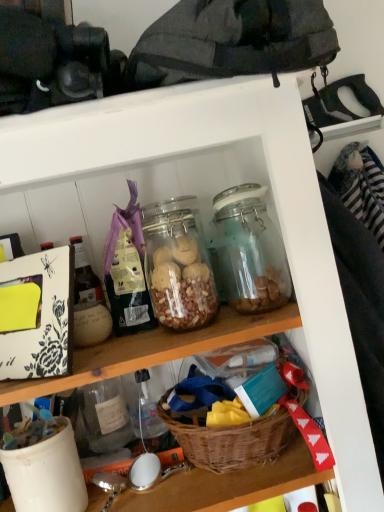
In order to face woven brown basket at lower center, should I rotate leftwards or rightwards?

You should look right and rotate roughly 5.720 degrees.

Find the location of a particular element. The width and height of the screenshot is (384, 512). woven brown basket at lower center is located at coordinates (232, 441).

Describe the element at coordinates (232, 441) in the screenshot. The height and width of the screenshot is (512, 384). I see `woven brown basket at lower center` at that location.

Locate an element on the screen. translucent glass jar at center is located at coordinates (180, 283).

What do you see at coordinates (180, 283) in the screenshot? The height and width of the screenshot is (512, 384). I see `translucent glass jar at center` at bounding box center [180, 283].

The image size is (384, 512). What are the coordinates of `woven brown basket at lower center` in the screenshot? It's located at (232, 441).

Which is more to the right, woven brown basket at lower center or translucent glass jar at center?

From the viewer's perspective, woven brown basket at lower center appears more on the right side.

From the picture: Who is more distant, woven brown basket at lower center or translucent glass jar at center?

Positioned behind is translucent glass jar at center.

Is point (193, 449) behind point (183, 260)?

That is True.

From the image's perspective, would you say woven brown basket at lower center is shown under translucent glass jar at center?

Yes, from the image's perspective, woven brown basket at lower center is beneath translucent glass jar at center.

From a real-world perspective, does woven brown basket at lower center sit lower than translucent glass jar at center?

Yes.

Can you confirm if woven brown basket at lower center is thinner than translucent glass jar at center?

No, woven brown basket at lower center is not thinner than translucent glass jar at center.

Which of these two, woven brown basket at lower center or translucent glass jar at center, stands taller?

With more height is translucent glass jar at center.

Which of these two, woven brown basket at lower center or translucent glass jar at center, is smaller?

translucent glass jar at center is smaller.

Can we say woven brown basket at lower center lies outside translucent glass jar at center?

Absolutely, woven brown basket at lower center is external to translucent glass jar at center.

Is woven brown basket at lower center next to translucent glass jar at center and touching it?

woven brown basket at lower center is not next to translucent glass jar at center, and they're not touching.

Is woven brown basket at lower center facing towards translucent glass jar at center?

No.

Can you tell me how much woven brown basket at lower center and translucent glass jar at center differ in facing direction?

The angle between the facing direction of woven brown basket at lower center and the facing direction of translucent glass jar at center is 3.82 degrees.

How distant is woven brown basket at lower center from translucent glass jar at center?

They are 9.19 inches apart.

The height and width of the screenshot is (512, 384). I want to click on food on the left of the woven brown basket at lower center, so coord(180,283).

Considering the positions of objects translucent glass jar at center and woven brown basket at lower center in the image provided, who is more to the right, translucent glass jar at center or woven brown basket at lower center?

woven brown basket at lower center.

Does translucent glass jar at center lie behind woven brown basket at lower center?

That is True.

Does point (200, 321) lie behind point (177, 439)?

No.

From the image's perspective, is translucent glass jar at center above or below woven brown basket at lower center?

translucent glass jar at center is situated higher than woven brown basket at lower center in the image.

From a real-world perspective, who is located lower, translucent glass jar at center or woven brown basket at lower center?

woven brown basket at lower center, from a real-world perspective.

Does translucent glass jar at center have a lesser width compared to woven brown basket at lower center?

Yes, translucent glass jar at center is thinner than woven brown basket at lower center.

Considering the relative sizes of translucent glass jar at center and woven brown basket at lower center in the image provided, is translucent glass jar at center taller than woven brown basket at lower center?

Correct, translucent glass jar at center is much taller as woven brown basket at lower center.

From the picture: Between translucent glass jar at center and woven brown basket at lower center, which one has smaller size?

With smaller size is translucent glass jar at center.

Is woven brown basket at lower center located within translucent glass jar at center?

Actually, woven brown basket at lower center is outside translucent glass jar at center.

Is the surface of translucent glass jar at center in direct contact with woven brown basket at lower center?

No.

Could you tell me if translucent glass jar at center is facing woven brown basket at lower center?

No, translucent glass jar at center is not oriented towards woven brown basket at lower center.

Can you tell me how much translucent glass jar at center and woven brown basket at lower center differ in facing direction?

There is a 3.82-degree angle between the facing directions of translucent glass jar at center and woven brown basket at lower center.

How far apart are translucent glass jar at center and woven brown basket at lower center?

translucent glass jar at center is 9.19 inches from woven brown basket at lower center.

Identify the location of basket that appears on the right of translucent glass jar at center. Image resolution: width=384 pixels, height=512 pixels. (232, 441).

Image resolution: width=384 pixels, height=512 pixels. In order to click on basket beneath the translucent glass jar at center (from a real-world perspective) in this screenshot , I will do `click(232, 441)`.

Where is `basket in front of the translucent glass jar at center`? Image resolution: width=384 pixels, height=512 pixels. basket in front of the translucent glass jar at center is located at coordinates (232, 441).